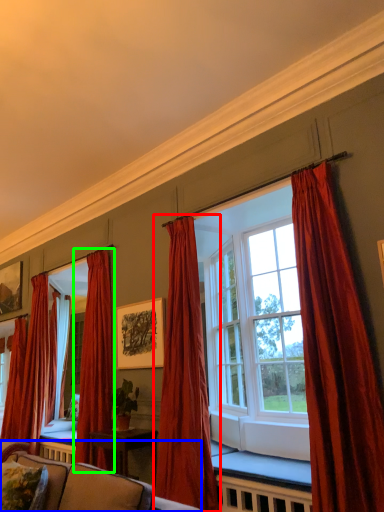
Question: Estimate the real-world distances between objects in this image. Which object is farther from curtain (highlighted by a red box), studio couch (highlighted by a blue box) or curtain (highlighted by a green box)?

Choices:
 (A) studio couch
 (B) curtain

Answer: (A)